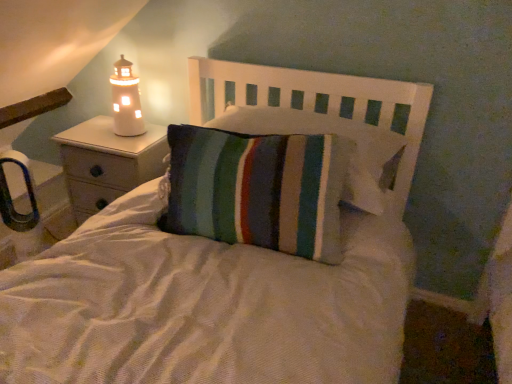
Question: Are striped fabric pillow at center and matte white nightstand at left far apart?

Choices:
 (A) no
 (B) yes

Answer: (A)

Question: Is striped fabric pillow at center not inside matte white nightstand at left?

Choices:
 (A) no
 (B) yes

Answer: (B)

Question: Could matte white nightstand at left be considered to be inside striped fabric pillow at center?

Choices:
 (A) no
 (B) yes

Answer: (A)

Question: From the image's perspective, is striped fabric pillow at center above matte white nightstand at left?

Choices:
 (A) yes
 (B) no

Answer: (A)

Question: Is striped fabric pillow at center with matte white nightstand at left?

Choices:
 (A) no
 (B) yes

Answer: (A)

Question: Does striped fabric pillow at center have a smaller size compared to matte white nightstand at left?

Choices:
 (A) no
 (B) yes

Answer: (B)

Question: From a real-world perspective, is striped fabric pillow at center over striped fabric pillow at center?

Choices:
 (A) no
 (B) yes

Answer: (A)

Question: Does striped fabric pillow at center appear on the right side of striped fabric pillow at center?

Choices:
 (A) no
 (B) yes

Answer: (A)

Question: Can you confirm if striped fabric pillow at center is thinner than striped fabric pillow at center?

Choices:
 (A) yes
 (B) no

Answer: (A)

Question: From the image's perspective, does striped fabric pillow at center appear higher than striped fabric pillow at center?

Choices:
 (A) yes
 (B) no

Answer: (B)

Question: From a real-world perspective, is striped fabric pillow at center physically below striped fabric pillow at center?

Choices:
 (A) no
 (B) yes

Answer: (B)

Question: Is striped fabric pillow at center outside of striped fabric pillow at center?

Choices:
 (A) yes
 (B) no

Answer: (A)

Question: Is striped fabric pillow at center taller than white ceramic lighthouse at left?

Choices:
 (A) yes
 (B) no

Answer: (A)